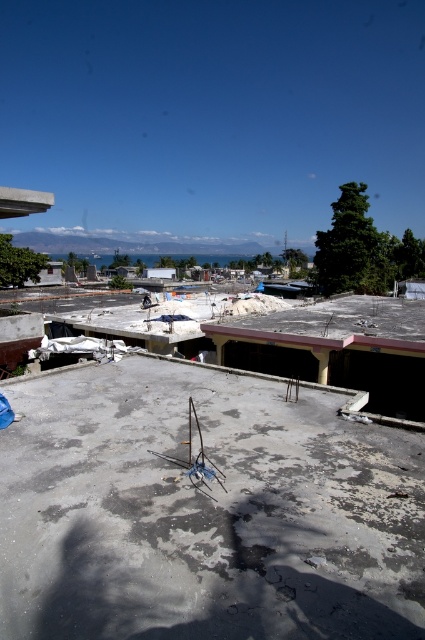
You are a construction worker who needs to place a heavy equipment on the gray concrete construction site at center and the concrete roof at center. Which location can accommodate the equipment based on their sizes?

The concrete roof at center has a larger size compared to the gray concrete construction site at center, so the equipment can be placed on the concrete roof at center.

Where is the gray concrete construction site at center located in the image?

The gray concrete construction site at center is located at point 2D coordinates of (204, 509).